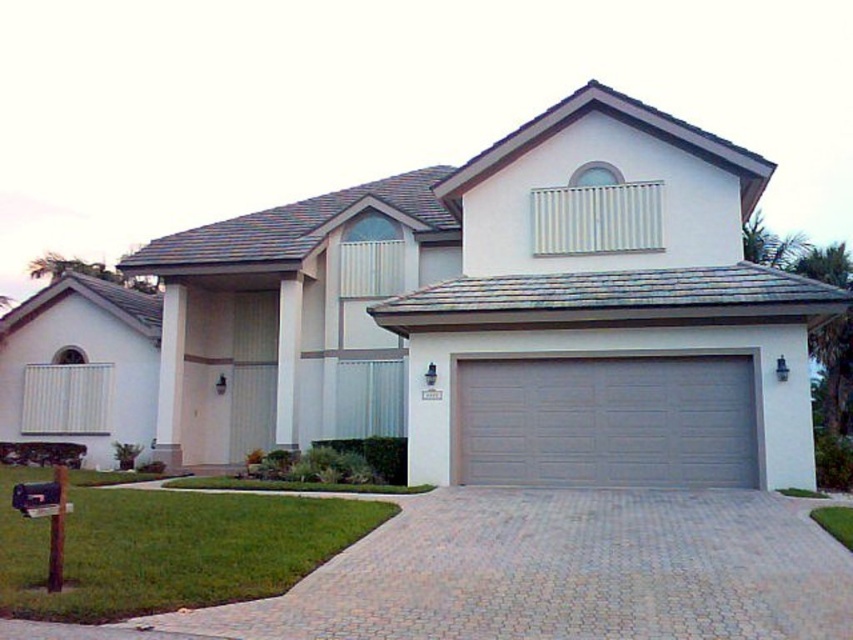
Question: Considering the relative positions of paved brick driveway at center and gray textured garage door at center in the image provided, where is paved brick driveway at center located with respect to gray textured garage door at center?

Choices:
 (A) left
 (B) right

Answer: (A)

Question: Is paved brick driveway at center below gray textured garage door at center?

Choices:
 (A) no
 (B) yes

Answer: (B)

Question: Which point is farther from the camera taking this photo?

Choices:
 (A) (645, 582)
 (B) (129, 593)
 (C) (682, 396)

Answer: (C)

Question: Based on their relative distances, which object is nearer to the green grass at lower left?

Choices:
 (A) gray textured garage door at center
 (B) paved brick driveway at center

Answer: (B)

Question: Which point appears farthest from the camera in this image?

Choices:
 (A) pos(793,516)
 (B) pos(753,449)
 (C) pos(158,600)

Answer: (B)

Question: Is gray textured garage door at center further to camera compared to green grass at lower left?

Choices:
 (A) yes
 (B) no

Answer: (A)